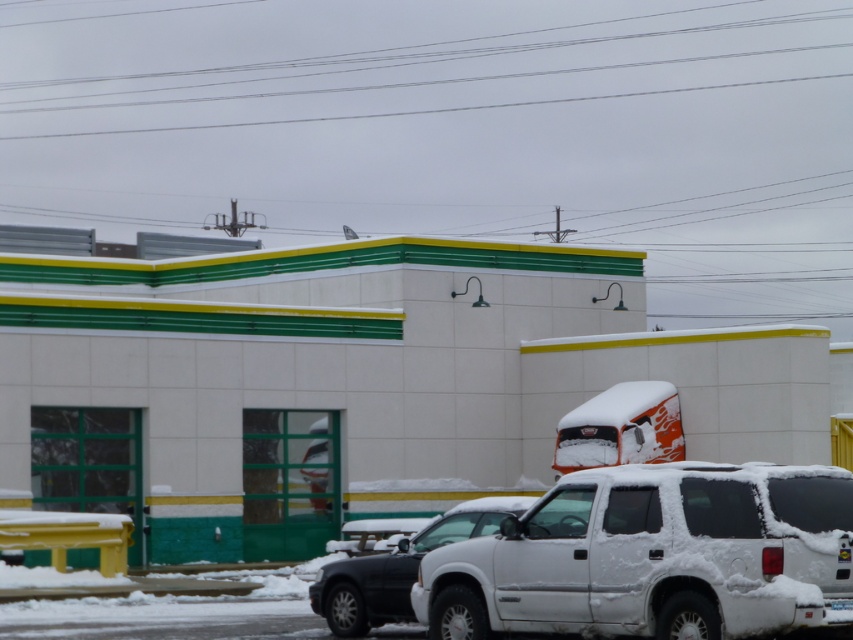
Who is higher up, white matte suv at lower right or orange matte truck at center?

Positioned higher is orange matte truck at center.

Does point (682, 468) come farther from viewer compared to point (628, 440)?

No.

Image resolution: width=853 pixels, height=640 pixels. What are the coordinates of `white matte suv at lower right` in the screenshot? It's located at (654, 556).

Based on the photo, can you confirm if white matte suv at lower right is positioned to the right of white matte suv at lower center?

Indeed, white matte suv at lower right is positioned on the right side of white matte suv at lower center.

What do you see at coordinates (654, 556) in the screenshot? The width and height of the screenshot is (853, 640). I see `white matte suv at lower right` at bounding box center [654, 556].

The width and height of the screenshot is (853, 640). What are the coordinates of `white matte suv at lower right` in the screenshot? It's located at (654, 556).

Is point (386, 595) positioned behind point (608, 416)?

That is False.

Does white matte suv at lower center appear over orange matte truck at center?

Actually, white matte suv at lower center is below orange matte truck at center.

Which is in front, point (331, 611) or point (659, 401)?

Point (331, 611) is more forward.

You are a GUI agent. You are given a task and a screenshot of the screen. Output one action in this format:
    pyautogui.click(x=<x>, y=<y>)
    Task: Click on the white matte suv at lower center
    This screenshot has height=640, width=853.
    Given the screenshot: What is the action you would take?
    pyautogui.click(x=398, y=568)